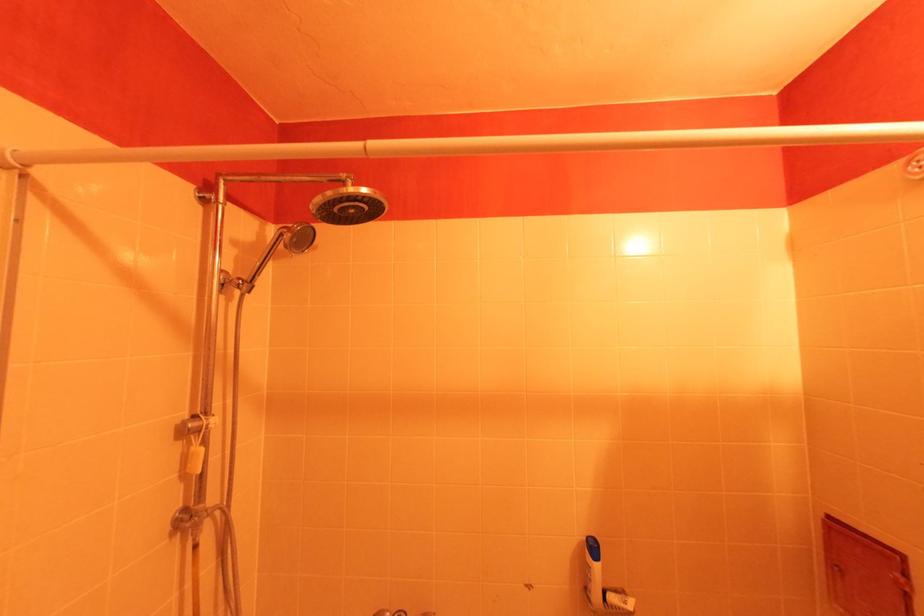
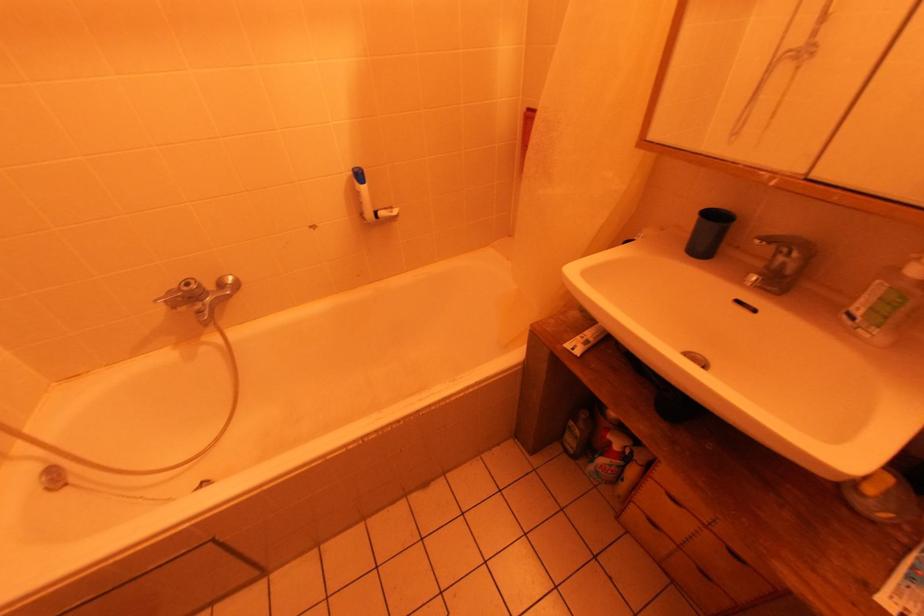
How did the camera likely rotate?

The rotation direction of the camera is right-down.